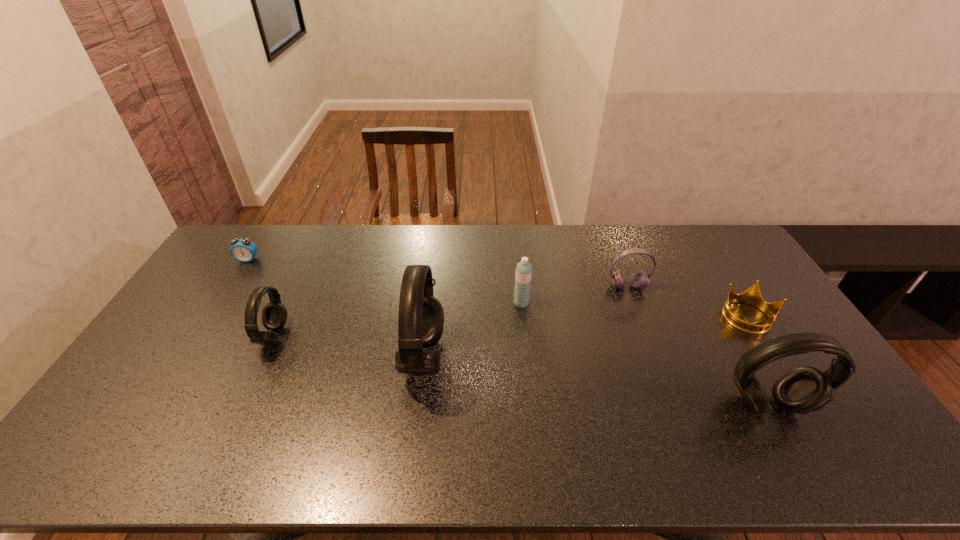
Find the location of a particular element. vacant area situated 0.310m on the earcups of the leftmost headset is located at coordinates (160, 336).

The width and height of the screenshot is (960, 540). Identify the location of free space located on the earcups of the leftmost headset. (213, 336).

The height and width of the screenshot is (540, 960). I want to click on blank space located on the earcups of the leftmost headset, so click(233, 336).

The height and width of the screenshot is (540, 960). Identify the location of blank space located 0.290m on the earcups of the second headset from left to right. (302, 357).

The height and width of the screenshot is (540, 960). In order to click on free space located 0.390m on the earcups of the second headset from left to right in this screenshot , I will do `click(268, 357)`.

Image resolution: width=960 pixels, height=540 pixels. I want to click on vacant space located 0.370m on the earcups of the second headset from left to right, so click(275, 357).

Identify the location of vacant space located 0.320m on the face of the farthest object. (204, 328).

The image size is (960, 540). I want to click on blank space located on the headband and ear cups of the farthest headset, so click(x=645, y=334).

At what (x,y) coordinates should I click in order to perform the action: click on free location located on the back of the water bottle. Please return your answer as a coordinate pair (x, y). The width and height of the screenshot is (960, 540). Looking at the image, I should click on (516, 245).

Image resolution: width=960 pixels, height=540 pixels. I want to click on blank area located 0.300m on the back of the crown, so click(703, 246).